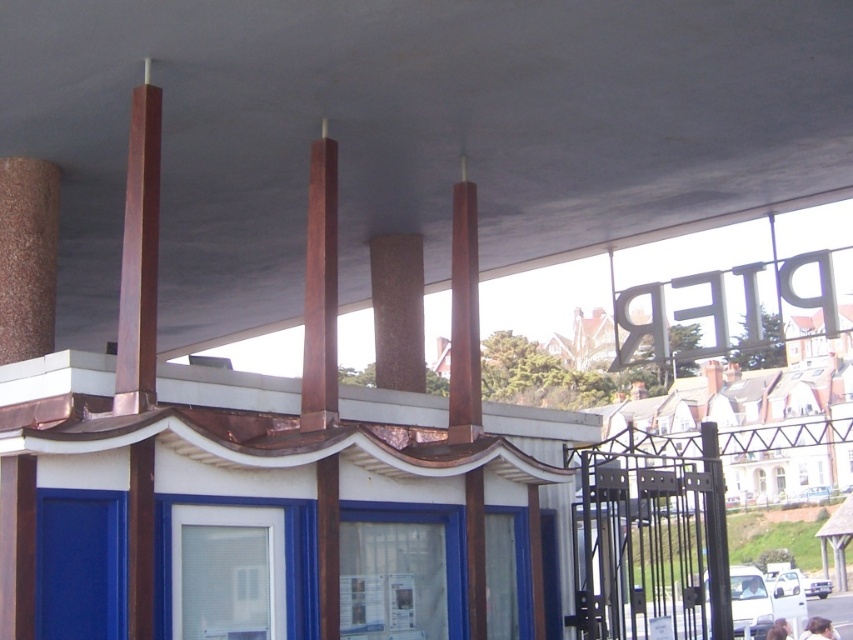
Who is shorter, brown textured chimney at left or brown polished pillar at center?

brown textured chimney at left

Does brown textured chimney at left have a greater width compared to brown polished pillar at center?

In fact, brown textured chimney at left might be narrower than brown polished pillar at center.

This screenshot has width=853, height=640. What do you see at coordinates (27, 257) in the screenshot?
I see `brown textured chimney at left` at bounding box center [27, 257].

Locate an element on the screen. brown textured chimney at left is located at coordinates (27, 257).

Does rustic wood beams at center come in front of brown textured chimney at left?

Yes, it is in front of brown textured chimney at left.

Does rustic wood beams at center have a greater width compared to brown textured chimney at left?

Yes.

Is point (155, 26) less distant than point (16, 275)?

Yes, it is.

Find the location of a particular element. The height and width of the screenshot is (640, 853). rustic wood beams at center is located at coordinates (410, 132).

Can you confirm if rustic wood beams at center is positioned to the right of brown polished pillar at center?

No, rustic wood beams at center is not to the right of brown polished pillar at center.

Does rustic wood beams at center come in front of brown polished pillar at center?

Yes, it is.

At what (x,y) coordinates should I click in order to perform the action: click on rustic wood beams at center. Please return your answer as a coordinate pair (x, y). This screenshot has width=853, height=640. Looking at the image, I should click on [x=410, y=132].